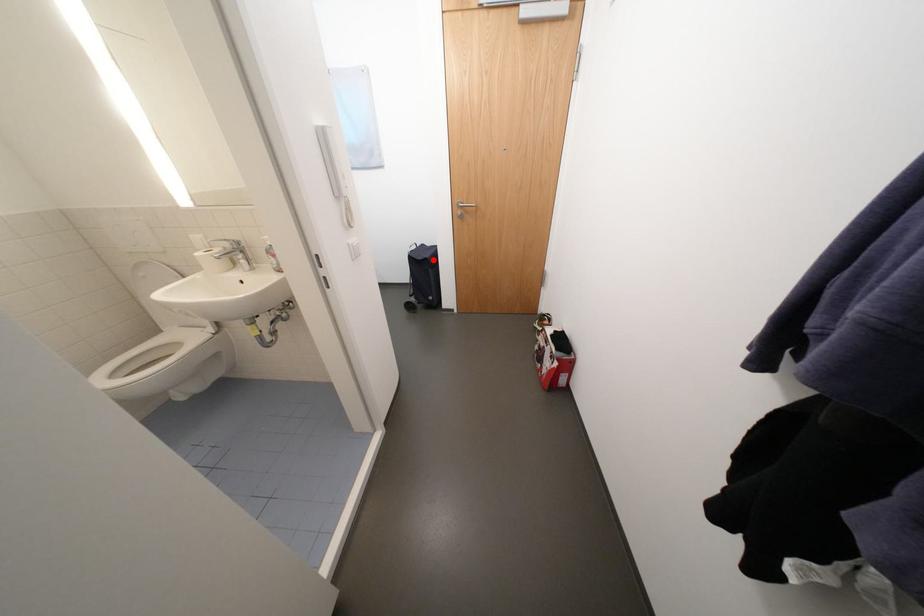
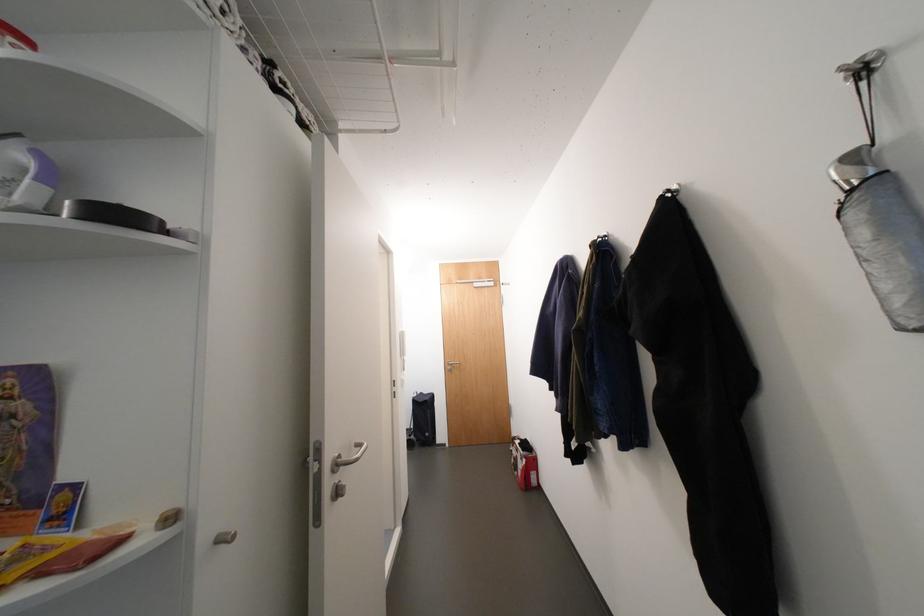
Question: I am providing you with two images of the same scene from different viewpoints. Given a red point in image1, look at the same physical point in image2. Is it:

Choices:
 (A) Closer to the viewpoint
 (B) Farther from the viewpoint

Answer: (B)